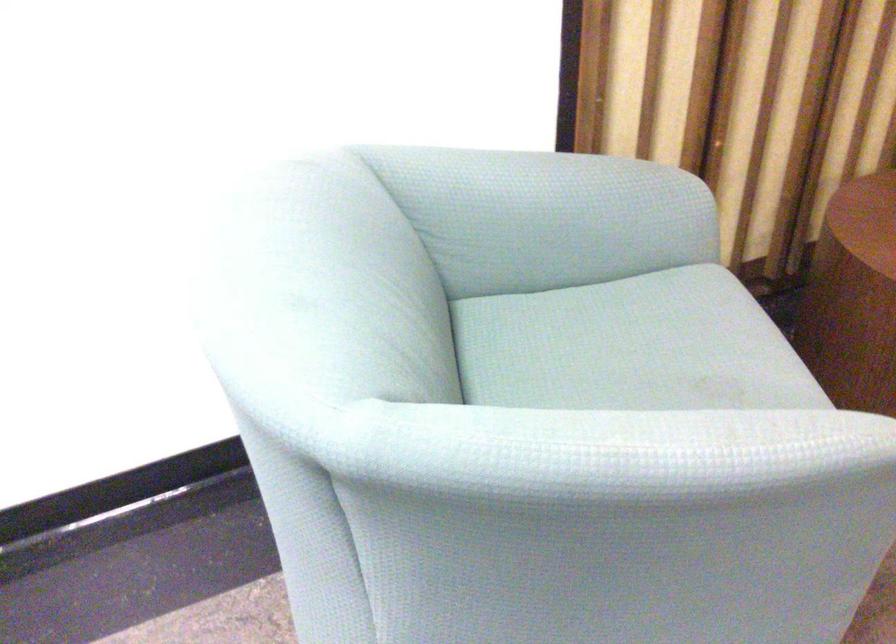
I want to click on light blue chair armrest, so click(545, 216).